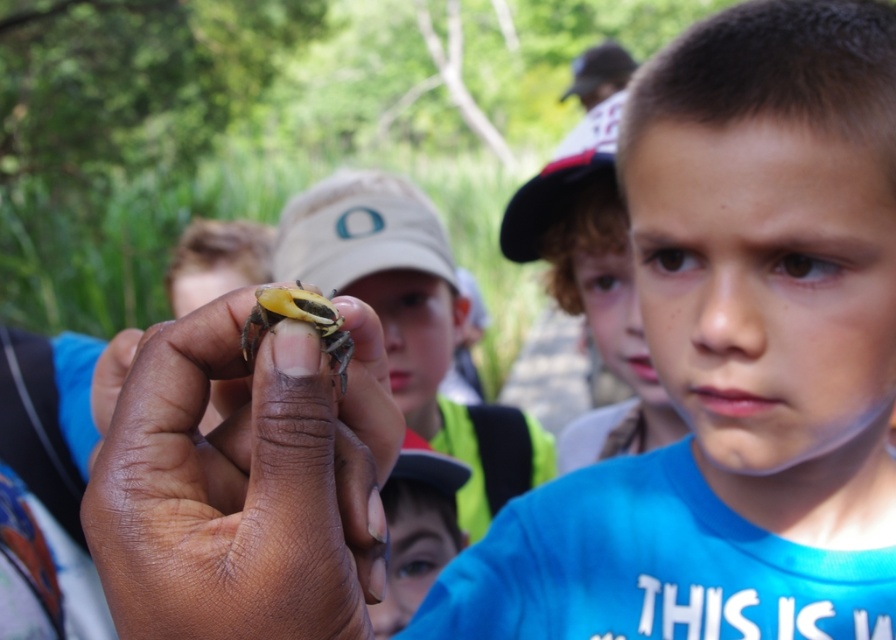
Where is the blue matte shirt at center located in the image?

The blue matte shirt at center is located at point 0.561 on the x axis and 0.820 on the y axis.

You are a photographer trying to capture the scene where the child in the blue matte shirt at center and the smooth skin face at center are both visible. Based on their positions, which object should be placed closer to the camera to ensure both are in the frame?

The blue matte shirt at center is to the right of the smooth skin face at center, so you should position the smooth skin face at center closer to the camera to ensure both are visible in the frame.